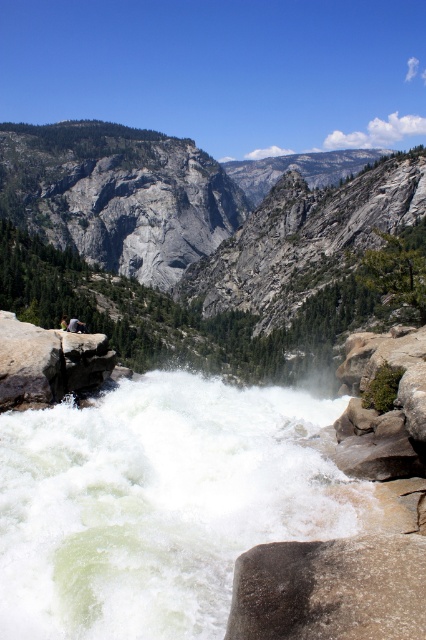
Between point (199, 563) and point (414, 577), which one is positioned behind?

The point (199, 563) is behind.

Between white frothy water at center and gray rough rock at lower center, which one appears on the left side from the viewer's perspective?

white frothy water at center

Does point (86, 563) come in front of point (348, 576)?

No, (86, 563) is behind (348, 576).

At what (x,y) coordinates should I click in order to perform the action: click on white frothy water at center. Please return your answer as a coordinate pair (x, y). This screenshot has width=426, height=640. Looking at the image, I should click on (155, 504).

How much distance is there between gray rock mountain at upper center and light brown leather jacket at center?

779.91 feet

Between gray rock mountain at upper center and light brown leather jacket at center, which one is positioned higher?

gray rock mountain at upper center is higher up.

Find the location of a particular element. gray rock mountain at upper center is located at coordinates (195, 244).

Between point (267, 433) and point (23, 406), which one is positioned in front?

Positioned in front is point (23, 406).

Is white frothy water at center shorter than gray rock at center?

Yes, white frothy water at center is shorter than gray rock at center.

This screenshot has width=426, height=640. Describe the element at coordinates (155, 504) in the screenshot. I see `white frothy water at center` at that location.

The image size is (426, 640). What are the coordinates of `white frothy water at center` in the screenshot? It's located at (155, 504).